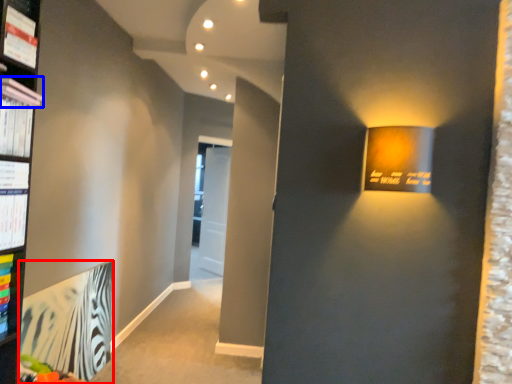
Question: Which object is further to the camera taking this photo, paperback book (highlighted by a red box) or book (highlighted by a blue box)?

Choices:
 (A) paperback book
 (B) book

Answer: (A)